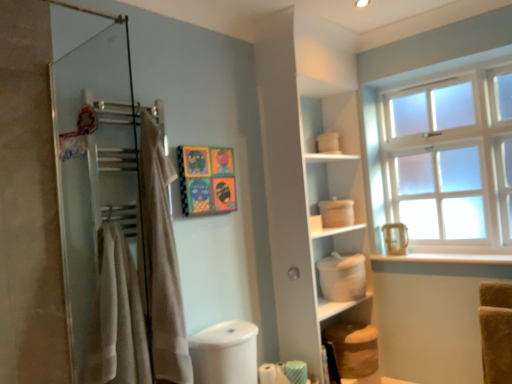
Question: From the image's perspective, is white matte window sill at lower right located beneath vibrant paper collage at center?

Choices:
 (A) yes
 (B) no

Answer: (A)

Question: Is vibrant paper collage at center located within white matte window sill at lower right?

Choices:
 (A) no
 (B) yes

Answer: (A)

Question: Does white matte window sill at lower right lie in front of vibrant paper collage at center?

Choices:
 (A) yes
 (B) no

Answer: (B)

Question: Can you confirm if white matte window sill at lower right is shorter than vibrant paper collage at center?

Choices:
 (A) no
 (B) yes

Answer: (B)

Question: Does white matte window sill at lower right turn towards vibrant paper collage at center?

Choices:
 (A) no
 (B) yes

Answer: (A)

Question: In the image, is beige cotton bath towel at left positioned in front of or behind beige fabric towel at left?

Choices:
 (A) front
 (B) behind

Answer: (A)

Question: Do you think beige cotton bath towel at left is within beige fabric towel at left, or outside of it?

Choices:
 (A) inside
 (B) outside

Answer: (B)

Question: Looking at their shapes, would you say beige cotton bath towel at left is wider or thinner than beige fabric towel at left?

Choices:
 (A) wide
 (B) thin

Answer: (A)

Question: Is beige cotton bath towel at left to the left or to the right of beige fabric towel at left in the image?

Choices:
 (A) right
 (B) left

Answer: (B)

Question: Is green striped toilet paper at lower center, marked as the second toilet paper in a left-to-right arrangement, inside the boundaries of white matte container at center-right, or outside?

Choices:
 (A) inside
 (B) outside

Answer: (B)

Question: Is green striped toilet paper at lower center, the 1th toilet paper from the right, to the left or to the right of white matte container at center-right in the image?

Choices:
 (A) left
 (B) right

Answer: (A)

Question: Is green striped toilet paper at lower center, marked as the second toilet paper in a left-to-right arrangement, taller or shorter than white matte container at center-right?

Choices:
 (A) tall
 (B) short

Answer: (B)

Question: Is green striped toilet paper at lower center, the 1th toilet paper from the right, bigger or smaller than white matte container at center-right?

Choices:
 (A) small
 (B) big

Answer: (A)

Question: Considering the positions of white matte container at center-right and green striped toilet paper at lower center, the 1th toilet paper from the right, in the image, is white matte container at center-right wider or thinner than green striped toilet paper at lower center, the 1th toilet paper from the right,?

Choices:
 (A) wide
 (B) thin

Answer: (A)

Question: Considering the positions of point (316, 238) and point (292, 382), is point (316, 238) closer or farther from the camera than point (292, 382)?

Choices:
 (A) farther
 (B) closer

Answer: (A)